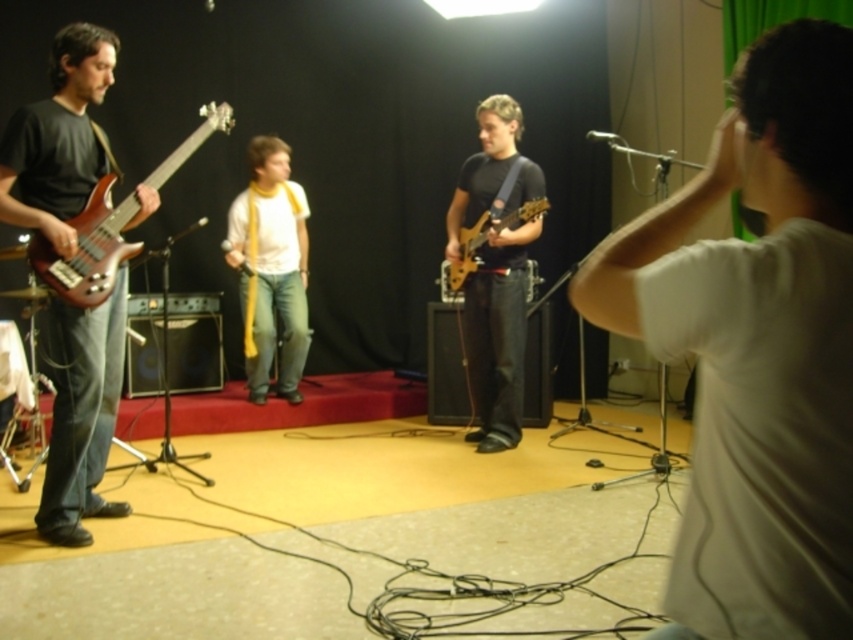
Between matte black guitar at center and yellow fabric scarf at center, which one has less height?

yellow fabric scarf at center

Does matte black guitar at center appear on the left side of yellow fabric scarf at center?

No, matte black guitar at center is not to the left of yellow fabric scarf at center.

Which is in front, point (496, 246) or point (291, 262)?

Point (496, 246) is more forward.

Locate an element on the screen. matte black guitar at center is located at coordinates (495, 269).

Does matte black bass guitar at left come behind matte black guitar at center?

No.

Which is more to the left, matte black bass guitar at left or matte black guitar at center?

From the viewer's perspective, matte black bass guitar at left appears more on the left side.

Is point (74, 54) in front of point (519, 394)?

Yes, it is.

What are the coordinates of `matte black bass guitar at left` in the screenshot? It's located at coord(59,138).

Is point (711, 600) closer to camera compared to point (506, 205)?

Yes, point (711, 600) is in front of point (506, 205).

Looking at this image, who is higher up, white matte t-shirt at center or matte black guitar at center?

matte black guitar at center

Describe the element at coordinates (757, 348) in the screenshot. I see `white matte t-shirt at center` at that location.

Locate an element on the screen. Image resolution: width=853 pixels, height=640 pixels. white matte t-shirt at center is located at coordinates (757, 348).